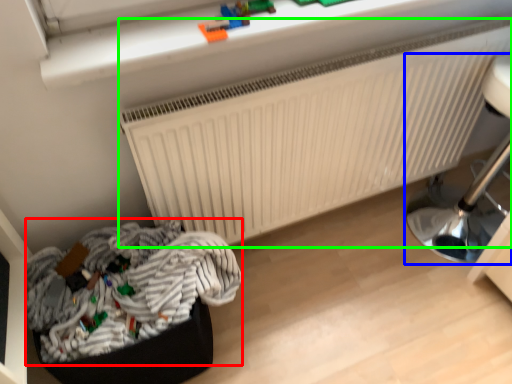
Question: Which is nearer to the laundry (highlighted by a red box)? furniture (highlighted by a blue box) or radiator (highlighted by a green box).

Choices:
 (A) furniture
 (B) radiator

Answer: (B)